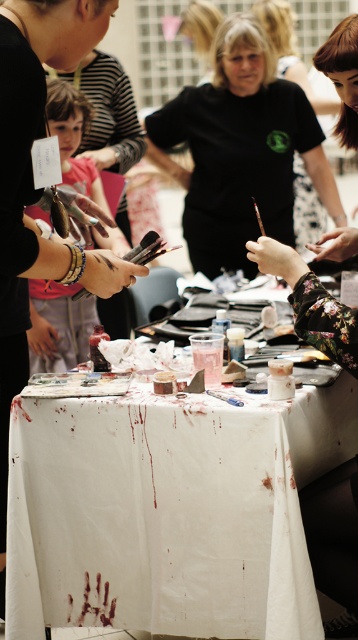
You are standing in the room and see the point at coordinates (66, 529). If you want to reach it without moving your feet, can you do so with your outstretched hand?

The point at coordinates (66, 529) is 2.20 meters away from you, so no, you cannot reach it with your outstretched hand since the average human arm length is about 0.7 meters.